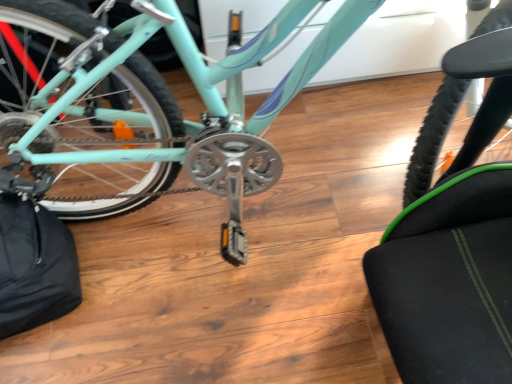
This screenshot has height=384, width=512. What do you see at coordinates (143, 106) in the screenshot?
I see `matte teal bicycle at center` at bounding box center [143, 106].

The image size is (512, 384). Find the location of `matte teal bicycle at center`. matte teal bicycle at center is located at coordinates (143, 106).

At what (x,y) coordinates should I click in order to perform the action: click on matte teal bicycle at center. Please return your answer as a coordinate pair (x, y). This screenshot has height=384, width=512. Looking at the image, I should click on (143, 106).